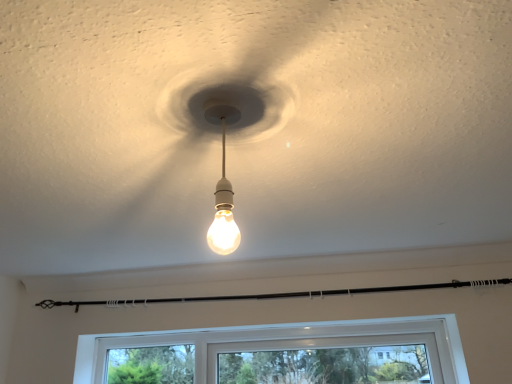
This screenshot has height=384, width=512. What do you see at coordinates (223, 213) in the screenshot? I see `matte white bulb at center` at bounding box center [223, 213].

Find the location of a particular element. The image size is (512, 384). matte white bulb at center is located at coordinates (223, 213).

You are a GUI agent. You are given a task and a screenshot of the screen. Output one action in this format:
    pyautogui.click(x=<x>, y=<y>)
    Task: Click on the matte white bulb at center
    The width and height of the screenshot is (512, 384).
    Given the screenshot: What is the action you would take?
    pyautogui.click(x=223, y=213)